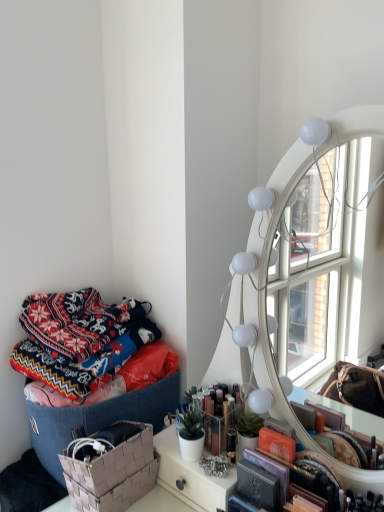
Question: Can you confirm if textured woven basket at left is smaller than knitted woolen blanket at left?

Choices:
 (A) no
 (B) yes

Answer: (A)

Question: Can you see textured woven basket at left touching knitted woolen blanket at left?

Choices:
 (A) no
 (B) yes

Answer: (A)

Question: Does textured woven basket at left lie in front of knitted woolen blanket at left?

Choices:
 (A) yes
 (B) no

Answer: (A)

Question: Considering the relative positions of textured woven basket at left and knitted woolen blanket at left in the image provided, is textured woven basket at left behind knitted woolen blanket at left?

Choices:
 (A) no
 (B) yes

Answer: (A)

Question: From a real-world perspective, does textured woven basket at left sit lower than knitted woolen blanket at left?

Choices:
 (A) yes
 (B) no

Answer: (A)

Question: Does textured woven basket at left have a lesser width compared to knitted woolen blanket at left?

Choices:
 (A) no
 (B) yes

Answer: (A)

Question: Is beige woven basket at lower left positioned before knitted woolen blanket at left?

Choices:
 (A) yes
 (B) no

Answer: (A)

Question: Is beige woven basket at lower left outside of knitted woolen blanket at left?

Choices:
 (A) no
 (B) yes

Answer: (B)

Question: Is beige woven basket at lower left positioned with its back to knitted woolen blanket at left?

Choices:
 (A) no
 (B) yes

Answer: (A)

Question: Is beige woven basket at lower left at the left side of knitted woolen blanket at left?

Choices:
 (A) no
 (B) yes

Answer: (A)

Question: Can you confirm if beige woven basket at lower left is wider than knitted woolen blanket at left?

Choices:
 (A) no
 (B) yes

Answer: (A)

Question: From a real-world perspective, is beige woven basket at lower left over knitted woolen blanket at left?

Choices:
 (A) no
 (B) yes

Answer: (A)

Question: Considering the relative sizes of beige woven basket at lower left and textured woven basket at left in the image provided, is beige woven basket at lower left smaller than textured woven basket at left?

Choices:
 (A) no
 (B) yes

Answer: (B)